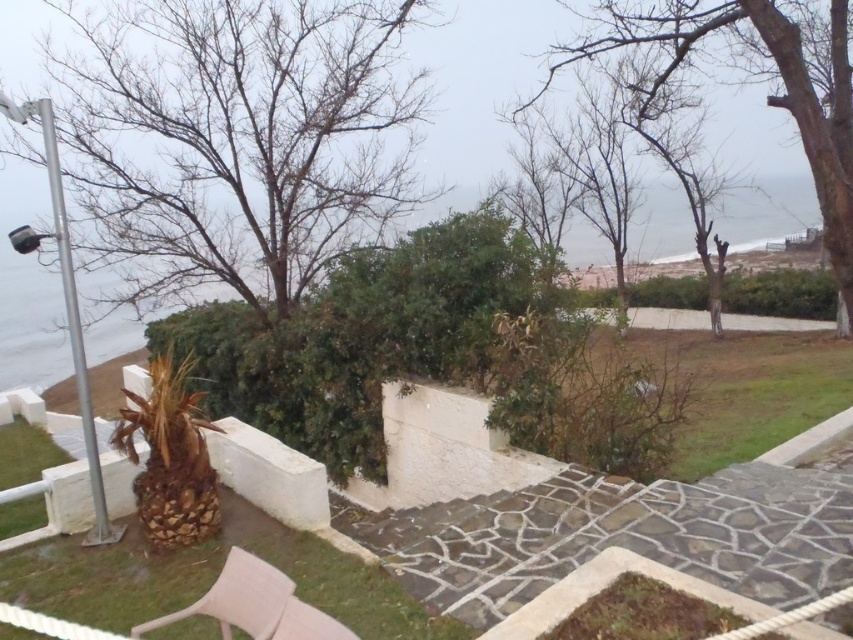
You are sitting in the beige fabric chair at lower center and want to look at the bare branches at upper left. In which direction should you turn your head?

You should turn your head to the left because the bare branches at upper left is positioned on the left side of beige fabric chair at lower center.

You are a bird looking for a place to rest. There are two options in the image, the bare branches at upper left and the bare wood tree at upper center. Which one is closer to you if you are perched on the stone pathway in the foreground?

The bare branches at upper left are closer to the stone pathway in the foreground than the bare wood tree at upper center because the distance between them is 4.51 meters.